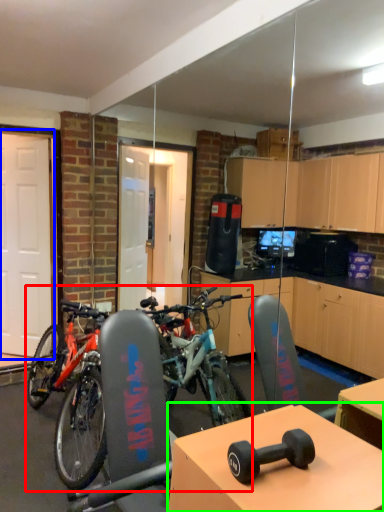
Question: Which is nearer to the bicycle (highlighted by a red box)? garage door (highlighted by a blue box) or table (highlighted by a green box).

Choices:
 (A) garage door
 (B) table

Answer: (A)